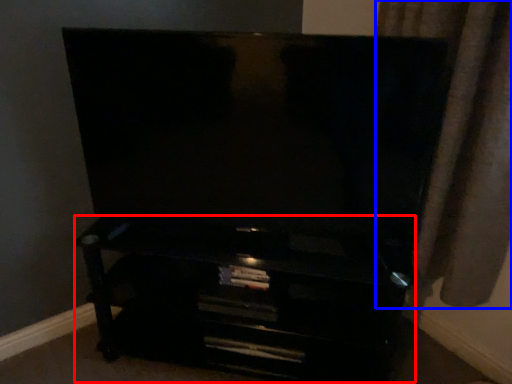
Question: Which object appears closest to the camera in this image, entertainment center (highlighted by a red box) or curtain (highlighted by a blue box)?

Choices:
 (A) entertainment center
 (B) curtain

Answer: (B)